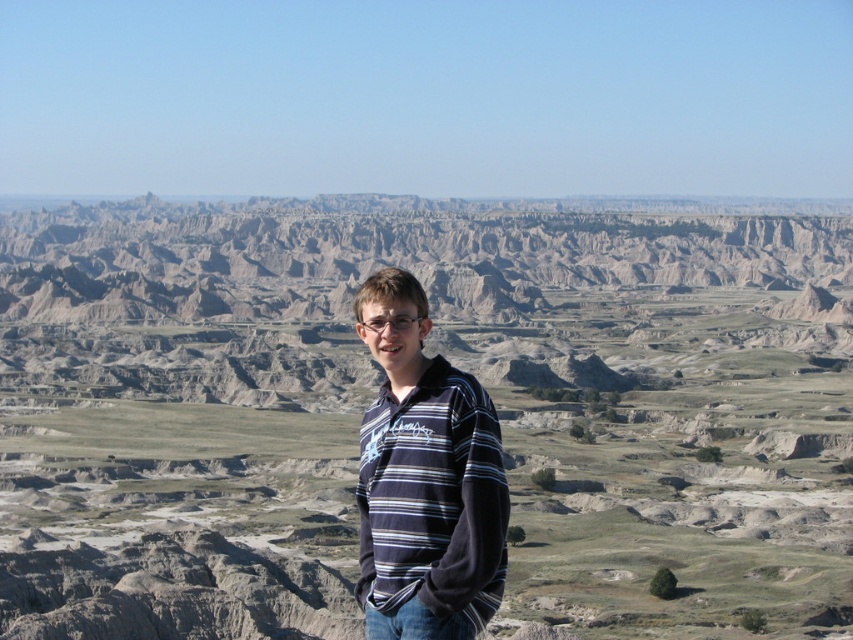
Question: Which of the following is the farthest from the observer?

Choices:
 (A) gray rock formation at center
 (B) striped cotton shirt at center

Answer: (A)

Question: Can you confirm if gray rock formation at center is positioned below striped cotton shirt at center?

Choices:
 (A) yes
 (B) no

Answer: (B)

Question: Which point is farther to the camera?

Choices:
 (A) (193, 387)
 (B) (386, 385)

Answer: (A)

Question: Which object is farther from the camera taking this photo?

Choices:
 (A) striped cotton shirt at center
 (B) gray rock formation at center

Answer: (B)

Question: In this image, where is gray rock formation at center located relative to striped cotton shirt at center?

Choices:
 (A) left
 (B) right

Answer: (A)

Question: Considering the relative positions of gray rock formation at center and striped cotton shirt at center in the image provided, where is gray rock formation at center located with respect to striped cotton shirt at center?

Choices:
 (A) left
 (B) right

Answer: (A)